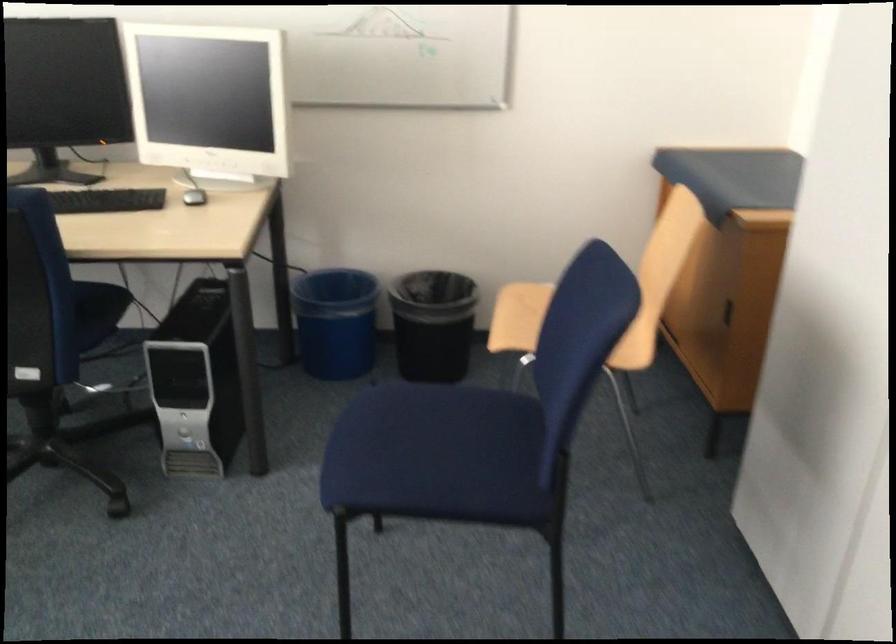
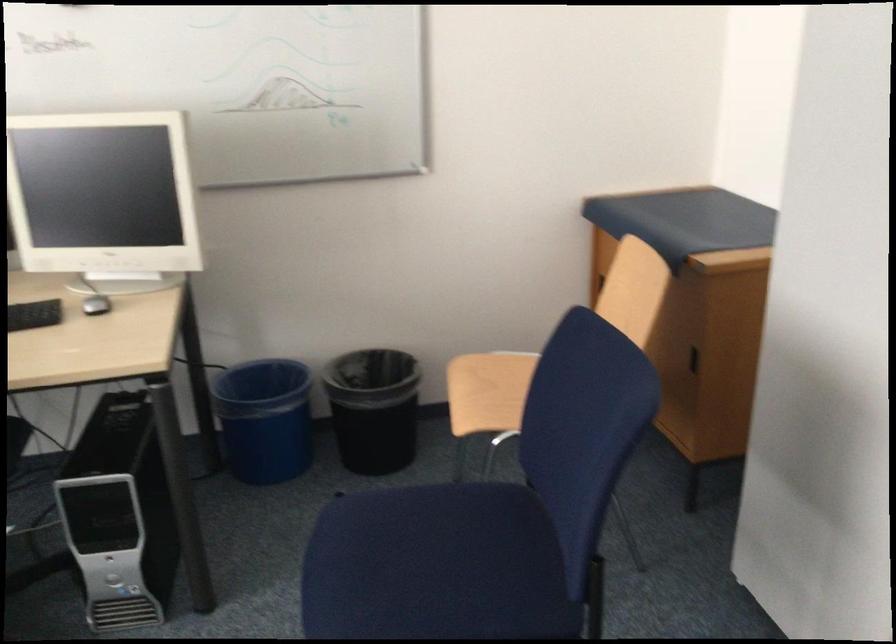
Question: The camera is either moving clockwise (left) or counter-clockwise (right) around the object. The first image is from the beginning of the video and the second image is from the end. Is the camera moving left or right when shooting the video?

Choices:
 (A) Left
 (B) Right

Answer: (A)